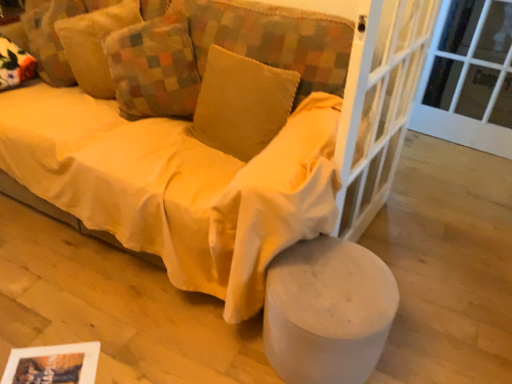
What do you see at coordinates (94, 44) in the screenshot? This screenshot has height=384, width=512. I see `soft yellow cushion at upper left, the first pillow in the left-to-right sequence` at bounding box center [94, 44].

The image size is (512, 384). Describe the element at coordinates (327, 311) in the screenshot. I see `white fabric stool at lower right` at that location.

At what (x,y) coordinates should I click in order to perform the action: click on white glass door at upper right. Please return your answer as a coordinate pair (x, y). This screenshot has width=512, height=384. Looking at the image, I should click on (469, 77).

The height and width of the screenshot is (384, 512). What do you see at coordinates (378, 104) in the screenshot?
I see `white glass screen door at center right` at bounding box center [378, 104].

Identify the location of soft yellow cushion at upper left, the third pillow when ordered from right to left. [94, 44].

Is white glass screen door at center right looking in the opposite direction of multicolored patchwork pillow at upper left, which ranks as the 2th pillow in right-to-left order?

Yes, white glass screen door at center right is facing away from multicolored patchwork pillow at upper left, which ranks as the 2th pillow in right-to-left order.

Which is more to the right, white glass screen door at center right or multicolored patchwork pillow at upper left, the second pillow positioned from the left?

Positioned to the right is white glass screen door at center right.

Between white glass screen door at center right and multicolored patchwork pillow at upper left, which ranks as the 2th pillow in right-to-left order, which one is positioned in front?

white glass screen door at center right is more forward.

Consider the image. From the image's perspective, is white glass screen door at center right beneath multicolored patchwork pillow at upper left, the second pillow positioned from the left?

Yes, from the image's perspective, white glass screen door at center right is beneath multicolored patchwork pillow at upper left, the second pillow positioned from the left.

Is multicolored patchwork pillow at upper left, the second pillow positioned from the left, bigger or smaller than white fabric stool at lower right?

multicolored patchwork pillow at upper left, the second pillow positioned from the left, is bigger than white fabric stool at lower right.

Where is `the 2nd pillow behind the white fabric stool at lower right`? This screenshot has height=384, width=512. the 2nd pillow behind the white fabric stool at lower right is located at coordinates (154, 67).

Considering the sizes of objects multicolored patchwork pillow at upper left, which ranks as the 2th pillow in right-to-left order, and white fabric stool at lower right in the image provided, who is wider, multicolored patchwork pillow at upper left, which ranks as the 2th pillow in right-to-left order, or white fabric stool at lower right?

white fabric stool at lower right is wider.

How different are the orientations of multicolored patchwork pillow at upper left, the second pillow positioned from the left, and white fabric stool at lower right in degrees?

The angle between the facing direction of multicolored patchwork pillow at upper left, the second pillow positioned from the left, and the facing direction of white fabric stool at lower right is 22.2 degrees.

How much distance is there between velvet yellow pillow at center, the 1th pillow positioned from the right, and white fabric stool at lower right?

velvet yellow pillow at center, the 1th pillow positioned from the right, and white fabric stool at lower right are 66.26 centimeters apart from each other.

Does velvet yellow pillow at center, which is counted as the third pillow, starting from the left, lie behind white fabric stool at lower right?

Yes, velvet yellow pillow at center, which is counted as the third pillow, starting from the left, is further from the viewer.

Is velvet yellow pillow at center, which is counted as the third pillow, starting from the left, next to white fabric stool at lower right and touching it?

No, velvet yellow pillow at center, which is counted as the third pillow, starting from the left, is not next to white fabric stool at lower right.

How different are the orientations of white glass door at upper right and white fabric stool at lower right in degrees?

They differ by 6.56 degrees in their facing directions.

Is point (496, 135) in front of point (377, 285)?

No, it is behind (377, 285).

From a real-world perspective, is white glass door at upper right beneath white fabric stool at lower right?

No, from a real-world perspective, white glass door at upper right is not under white fabric stool at lower right.

Can you confirm if white glass door at upper right is positioned to the right of white fabric stool at lower right?

Yes, white glass door at upper right is to the right of white fabric stool at lower right.

Which is farther from the camera, (36, 181) or (170, 109)?

The point (170, 109) is farther.

From a real-world perspective, which object stands above the other?

multicolored patchwork pillow at upper left, which ranks as the 2th pillow in right-to-left order.

Does matte yellow fabric couch at center turn towards multicolored patchwork pillow at upper left, which ranks as the 2th pillow in right-to-left order?

No, matte yellow fabric couch at center does not turn towards multicolored patchwork pillow at upper left, which ranks as the 2th pillow in right-to-left order.

Consider the image. Is white fabric stool at lower right spatially inside soft yellow cushion at upper left, the first pillow in the left-to-right sequence, or outside of it?

The correct answer is: outside.

From the image's perspective, which is above, white fabric stool at lower right or soft yellow cushion at upper left, the first pillow in the left-to-right sequence?

From the image's view, soft yellow cushion at upper left, the first pillow in the left-to-right sequence, is above.

Which pillow is the 3rd one when counting from the left side of the white fabric stool at lower right? Please provide its 2D coordinates.

[(94, 44)]

Looking at this image, is white glass door at upper right far away from soft yellow cushion at upper left, the third pillow when ordered from right to left?

white glass door at upper right is positioned a significant distance from soft yellow cushion at upper left, the third pillow when ordered from right to left.

Considering the relative positions of white glass door at upper right and soft yellow cushion at upper left, the third pillow when ordered from right to left, in the image provided, is white glass door at upper right to the right of soft yellow cushion at upper left, the third pillow when ordered from right to left, from the viewer's perspective?

Yes.

Considering the sizes of objects white glass door at upper right and soft yellow cushion at upper left, the first pillow in the left-to-right sequence, in the image provided, who is smaller, white glass door at upper right or soft yellow cushion at upper left, the first pillow in the left-to-right sequence,?

soft yellow cushion at upper left, the first pillow in the left-to-right sequence.

Which is closer to the camera, (498, 145) or (101, 21)?

The point (101, 21) is in front.

Locate an element on the screen. The height and width of the screenshot is (384, 512). pillow that is the 3rd object above the white glass screen door at center right (from a real-world perspective) is located at coordinates (154, 67).

Locate an element on the screen. The image size is (512, 384). stool below the multicolored patchwork pillow at upper left, the second pillow positioned from the left (from the image's perspective) is located at coordinates (327, 311).

From the image, which object appears to be farther from soft yellow cushion at upper left, the third pillow when ordered from right to left, white glass screen door at center right or multicolored patchwork pillow at upper left, which ranks as the 2th pillow in right-to-left order?

The object further to soft yellow cushion at upper left, the third pillow when ordered from right to left, is white glass screen door at center right.

Which object lies nearer to the anchor point multicolored patchwork pillow at upper left, the second pillow positioned from the left, velvet yellow pillow at center, which is counted as the third pillow, starting from the left, or matte yellow fabric couch at center?

The object closer to multicolored patchwork pillow at upper left, the second pillow positioned from the left, is velvet yellow pillow at center, which is counted as the third pillow, starting from the left.

Based on their spatial positions, is multicolored patchwork pillow at upper left, the second pillow positioned from the left, or white glass screen door at center right closer to velvet yellow pillow at center, the 1th pillow positioned from the right?

multicolored patchwork pillow at upper left, the second pillow positioned from the left.

Looking at the image, which one is located closer to matte yellow fabric couch at center, velvet yellow pillow at center, which is counted as the third pillow, starting from the left, or multicolored patchwork pillow at upper left, the second pillow positioned from the left?

Among the two, velvet yellow pillow at center, which is counted as the third pillow, starting from the left, is located nearer to matte yellow fabric couch at center.

Which object lies further to the anchor point soft yellow cushion at upper left, the third pillow when ordered from right to left, velvet yellow pillow at center, which is counted as the third pillow, starting from the left, or white fabric stool at lower right?

Among the two, white fabric stool at lower right is located further to soft yellow cushion at upper left, the third pillow when ordered from right to left.

Based on their spatial positions, is white glass screen door at center right or white glass door at upper right closer to velvet yellow pillow at center, the 1th pillow positioned from the right?

Among the two, white glass screen door at center right is located nearer to velvet yellow pillow at center, the 1th pillow positioned from the right.

When comparing their distances from white glass door at upper right, does soft yellow cushion at upper left, the third pillow when ordered from right to left, or white glass screen door at center right seem further?

soft yellow cushion at upper left, the third pillow when ordered from right to left, is positioned further to the anchor white glass door at upper right.

When comparing their distances from white glass door at upper right, does velvet yellow pillow at center, which is counted as the third pillow, starting from the left, or soft yellow cushion at upper left, the first pillow in the left-to-right sequence, seem further?

soft yellow cushion at upper left, the first pillow in the left-to-right sequence, is further to white glass door at upper right.

The width and height of the screenshot is (512, 384). In order to click on stool between soft yellow cushion at upper left, the first pillow in the left-to-right sequence, and white glass screen door at center right from left to right in this screenshot , I will do `click(327, 311)`.

The width and height of the screenshot is (512, 384). Identify the location of stool situated between matte yellow fabric couch at center and white glass door at upper right from left to right. (327, 311).

I want to click on screen door located between white fabric stool at lower right and white glass door at upper right in the left-right direction, so point(378,104).

Locate an element on the screen. screen door between multicolored patchwork pillow at upper left, the second pillow positioned from the left, and white glass door at upper right from left to right is located at coordinates (378, 104).